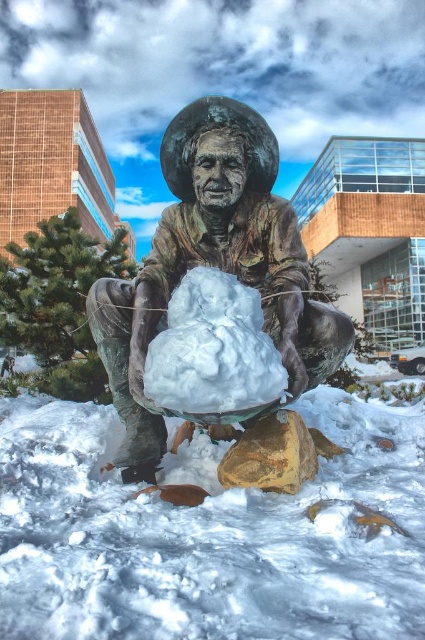
Question: Which is nearer to the white fluffy snowman at center?

Choices:
 (A) bronze statue at center
 (B) white fluffy snow at center
 (C) rustic brown rock at center

Answer: (A)

Question: Does white fluffy snow at center have a smaller size compared to white fluffy snowman at center?

Choices:
 (A) no
 (B) yes

Answer: (A)

Question: Does white fluffy snowman at center have a greater width compared to rustic brown rock at center?

Choices:
 (A) no
 (B) yes

Answer: (B)

Question: Which of the following is the closest to the observer?

Choices:
 (A) white fluffy snow at center
 (B) bronze statue at center
 (C) white fluffy snowman at center
 (D) rustic brown rock at center

Answer: (A)

Question: Is white fluffy snow at center bigger than white fluffy snowman at center?

Choices:
 (A) no
 (B) yes

Answer: (B)

Question: Which point is farther to the camera?

Choices:
 (A) (226, 417)
 (B) (25, 621)
 (C) (297, 444)
 (D) (328, 320)

Answer: (D)